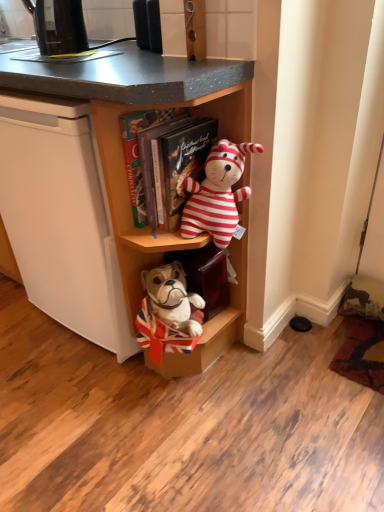
Question: Should I look upward or downward to see black plastic kettle at upper left?

Choices:
 (A) down
 (B) up

Answer: (B)

Question: Can you confirm if wooden cabinet at center is positioned to the left of striped plush toy at center?

Choices:
 (A) yes
 (B) no

Answer: (A)

Question: Can you confirm if wooden cabinet at center is positioned to the right of striped plush toy at center?

Choices:
 (A) no
 (B) yes

Answer: (A)

Question: From the image's perspective, does wooden cabinet at center appear lower than striped plush toy at center?

Choices:
 (A) yes
 (B) no

Answer: (B)

Question: Would you say wooden cabinet at center is outside striped plush toy at center?

Choices:
 (A) yes
 (B) no

Answer: (A)

Question: From a real-world perspective, is wooden cabinet at center located higher than striped plush toy at center?

Choices:
 (A) yes
 (B) no

Answer: (B)

Question: Considering the relative sizes of wooden cabinet at center and striped plush toy at center in the image provided, is wooden cabinet at center shorter than striped plush toy at center?

Choices:
 (A) yes
 (B) no

Answer: (B)

Question: Is black plastic kettle at upper left aimed at striped plush toy at center?

Choices:
 (A) yes
 (B) no

Answer: (B)

Question: Is black plastic kettle at upper left placed right next to striped plush toy at center?

Choices:
 (A) no
 (B) yes

Answer: (A)

Question: Is black plastic kettle at upper left not inside striped plush toy at center?

Choices:
 (A) yes
 (B) no

Answer: (A)

Question: Does black plastic kettle at upper left have a greater width compared to striped plush toy at center?

Choices:
 (A) no
 (B) yes

Answer: (A)

Question: Is black plastic kettle at upper left not close to striped plush toy at center?

Choices:
 (A) no
 (B) yes

Answer: (A)

Question: Is black plastic kettle at upper left shorter than striped plush toy at center?

Choices:
 (A) no
 (B) yes

Answer: (B)

Question: Is the position of striped plush toy at center more distant than that of wooden cabinet at center?

Choices:
 (A) yes
 (B) no

Answer: (A)